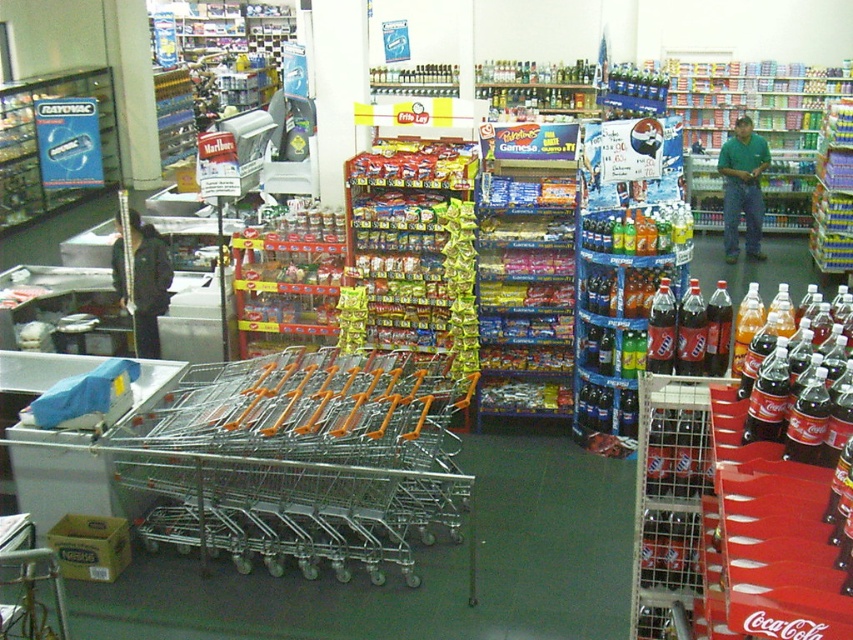
Question: Which point is farther to the camera?

Choices:
 (A) (136, 333)
 (B) (730, 150)
 (C) (410, 438)
 (D) (703, 605)

Answer: (B)

Question: Is coca-cola plastic bottles at center right closer to camera compared to green matte shirt at center?

Choices:
 (A) yes
 (B) no

Answer: (A)

Question: Is the position of black fabric jacket at left more distant than that of green matte shirt at center?

Choices:
 (A) no
 (B) yes

Answer: (A)

Question: Estimate the real-world distances between objects in this image. Which object is closer to the black fabric jacket at left?

Choices:
 (A) coca-cola plastic bottles at center right
 (B) silver/metallic shopping cart at center
 (C) green matte shirt at center

Answer: (B)

Question: Can you confirm if black fabric jacket at left is smaller than green matte shirt at center?

Choices:
 (A) no
 (B) yes

Answer: (B)

Question: Among these objects, which one is farthest from the camera?

Choices:
 (A) coca-cola plastic bottles at center right
 (B) silver/metallic shopping cart at center
 (C) black fabric jacket at left
 (D) green matte shirt at center

Answer: (D)